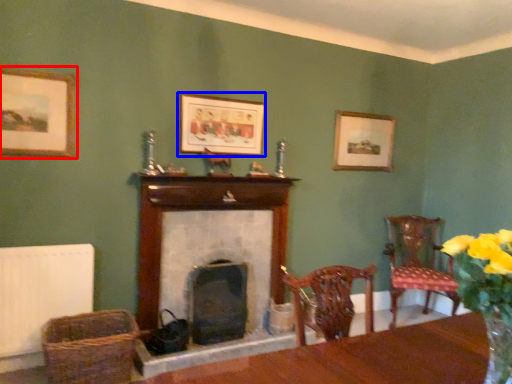
Question: Which of the following is the closest to the observer, picture frame (highlighted by a red box) or picture frame (highlighted by a blue box)?

Choices:
 (A) picture frame
 (B) picture frame

Answer: (A)